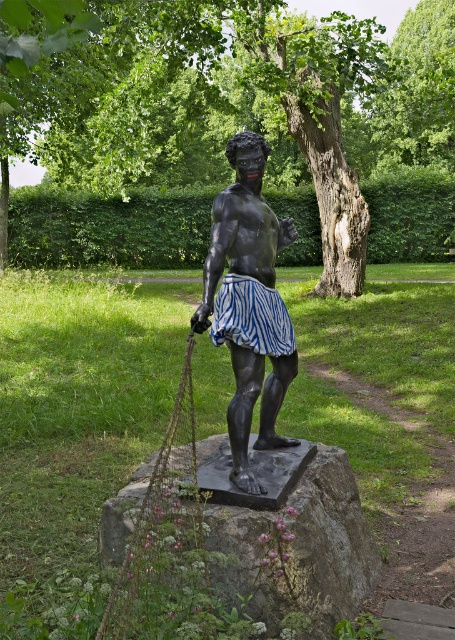
Question: Among these objects, which one is farthest from the camera?

Choices:
 (A) black polished statue at center
 (B) dark gray stone at center
 (C) green textured tree at center

Answer: (C)

Question: Can you confirm if green textured tree at center is positioned above green leafy tree at upper center?

Choices:
 (A) yes
 (B) no

Answer: (B)

Question: Can you confirm if green textured tree at center is thinner than dark gray stone at center?

Choices:
 (A) no
 (B) yes

Answer: (A)

Question: Which object is farther from the camera taking this photo?

Choices:
 (A) green textured tree at center
 (B) dark gray stone at center
 (C) green leafy tree at upper center

Answer: (C)

Question: Can you confirm if dark gray stone at center is positioned above black polished statue at center?

Choices:
 (A) yes
 (B) no

Answer: (B)

Question: Which point is farther to the camera?

Choices:
 (A) dark gray stone at center
 (B) black polished statue at center
 (C) green textured tree at center

Answer: (C)